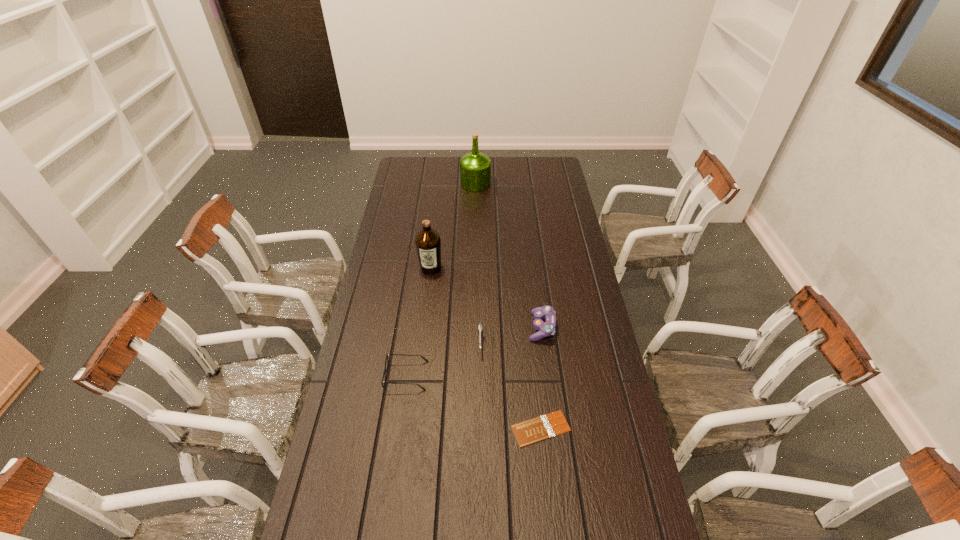
Locate an element on the screen. The image size is (960, 540). the farthest object is located at coordinates (475, 167).

The height and width of the screenshot is (540, 960). Identify the location of the farther olive oil. (475, 167).

Find the location of a particular element. the shorter olive oil is located at coordinates (428, 242).

Identify the location of the second tallest object. This screenshot has height=540, width=960. (428, 242).

Where is `control`? Image resolution: width=960 pixels, height=540 pixels. control is located at coordinates (547, 328).

The height and width of the screenshot is (540, 960). In order to click on the third shortest object in this screenshot , I will do `click(480, 328)`.

Identify the location of the second nearest object. (384, 372).

Locate an element on the screen. The image size is (960, 540). spectacles is located at coordinates (384, 372).

Where is `chocolate bar`? Image resolution: width=960 pixels, height=540 pixels. chocolate bar is located at coordinates (528, 432).

The width and height of the screenshot is (960, 540). Identify the location of the shortest object. (528, 432).